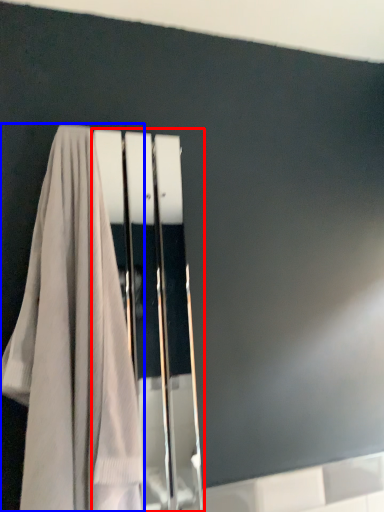
Question: Among these objects, which one is nearest to the camera, screen door (highlighted by a red box) or towel (highlighted by a blue box)?

Choices:
 (A) screen door
 (B) towel

Answer: (B)